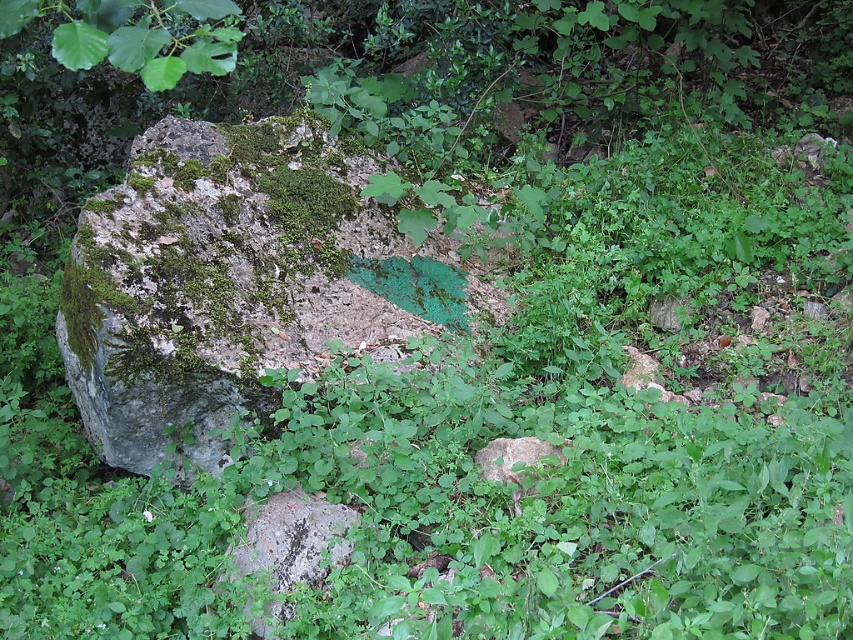
Question: Which point is closer to the camera?

Choices:
 (A) click(x=267, y=566)
 (B) click(x=223, y=180)

Answer: (A)

Question: Which of the following is the closest to the observer?

Choices:
 (A) (209, 406)
 (B) (265, 577)

Answer: (B)

Question: Does mossy rock at center have a lesser width compared to speckled gray rock at center?

Choices:
 (A) no
 (B) yes

Answer: (A)

Question: Does mossy rock at center have a greater width compared to speckled gray rock at center?

Choices:
 (A) no
 (B) yes

Answer: (B)

Question: In this image, where is mossy rock at center located relative to speckled gray rock at center?

Choices:
 (A) left
 (B) right

Answer: (A)